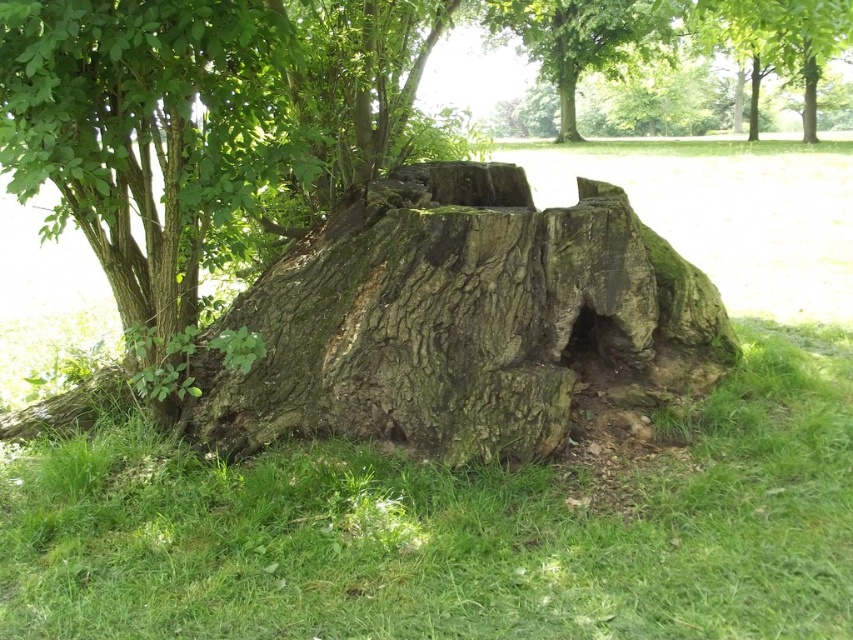
Which is in front, point (550, 436) or point (608, 321)?

Positioned in front is point (550, 436).

Between green mossy stump at center and green mossy hole at lower center, which one has more height?

green mossy stump at center

Is point (463, 449) more distant than point (590, 364)?

No, (463, 449) is closer to viewer.

I want to click on green mossy stump at center, so click(457, 317).

In the scene shown: Between green grass at lower center and green mossy hole at lower center, which one appears on the right side from the viewer's perspective?

green mossy hole at lower center

The image size is (853, 640). What do you see at coordinates (454, 529) in the screenshot?
I see `green grass at lower center` at bounding box center [454, 529].

Find the location of a particular element. green grass at lower center is located at coordinates (454, 529).

Which is more to the left, green grass at lower center or smooth green bark at upper center?

green grass at lower center

Is point (235, 552) in front of point (589, 58)?

Yes, it is in front of point (589, 58).

Does point (490, 512) lie in front of point (633, 28)?

That is True.

Find the location of a particular element. This screenshot has width=853, height=640. green grass at lower center is located at coordinates (454, 529).